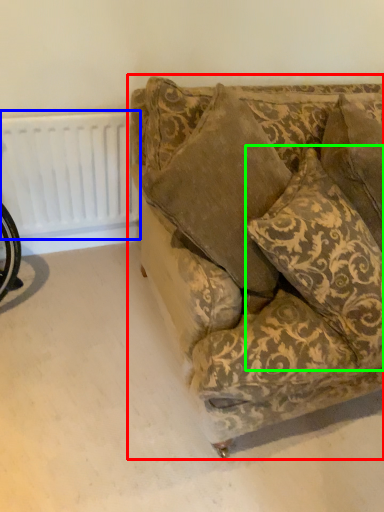
Question: Which object is the farthest from studio couch (highlighted by a red box)? Choose among these: radiator (highlighted by a blue box) or throw pillow (highlighted by a green box).

Choices:
 (A) radiator
 (B) throw pillow

Answer: (A)